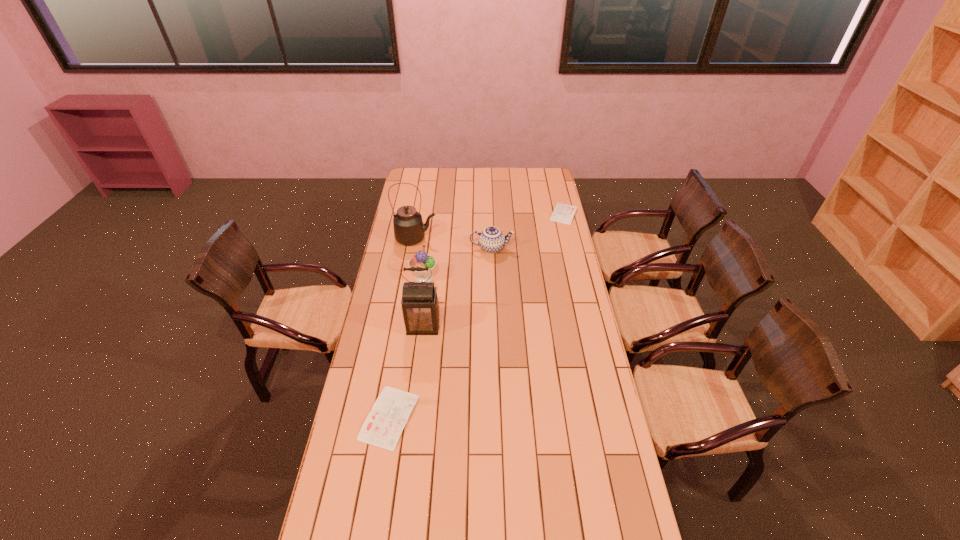
Locate an element on the screen. The image size is (960, 540). the fifth tallest object is located at coordinates (383, 426).

Image resolution: width=960 pixels, height=540 pixels. What are the coordinates of `the nearer diary` in the screenshot? It's located at (383, 426).

Find the location of `the farther diary`. the farther diary is located at coordinates (563, 213).

I want to click on the shortest object, so click(x=563, y=213).

The width and height of the screenshot is (960, 540). In order to click on the third nearest object in this screenshot , I will do `click(421, 259)`.

Where is `the fourth shortest object`? This screenshot has width=960, height=540. the fourth shortest object is located at coordinates (421, 259).

Image resolution: width=960 pixels, height=540 pixels. Find the location of `the fourth tallest object`. the fourth tallest object is located at coordinates (491, 239).

Where is `chinaware`? chinaware is located at coordinates (491, 239).

You are a GUI agent. You are given a task and a screenshot of the screen. Output one action in this format:
    pyautogui.click(x=<x>, y=<y>)
    Task: Click on the kettle
    The height and width of the screenshot is (540, 960).
    Given the screenshot: What is the action you would take?
    pyautogui.click(x=409, y=229)

Find the location of `lantern`. lantern is located at coordinates (420, 308).